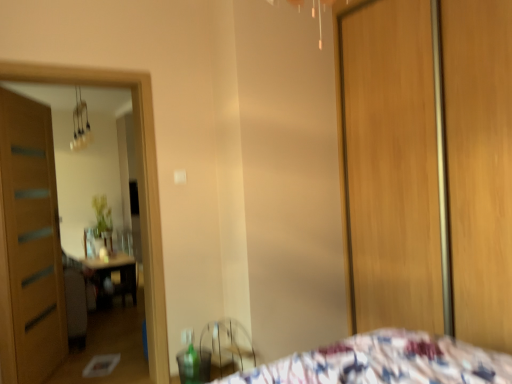
What do you see at coordinates (80, 123) in the screenshot? I see `metallic glass chandelier at upper left` at bounding box center [80, 123].

What do you see at coordinates (430, 165) in the screenshot?
I see `wooden screen door at right` at bounding box center [430, 165].

The width and height of the screenshot is (512, 384). Find the location of `wooden door at left`. wooden door at left is located at coordinates (31, 240).

Is wooden screen door at right at the left side of wooden door at left?

A: No.

From a real-world perspective, is wooden screen door at right under wooden door at left?

No, from a real-world perspective, wooden screen door at right is not under wooden door at left.

Is wooden screen door at right directly adjacent to wooden door at left?

No, wooden screen door at right is not in contact with wooden door at left.

From a real-world perspective, which object rests below the other?

wooden screen door at right is physically lower.

Image resolution: width=512 pixels, height=384 pixels. Find the location of `screen door located on the right of metallic glass chandelier at upper left`. screen door located on the right of metallic glass chandelier at upper left is located at coordinates (430, 165).

Based on the photo, in the image, is wooden screen door at right on the left side or the right side of metallic glass chandelier at upper left?

In the image, wooden screen door at right appears on the right side of metallic glass chandelier at upper left.

Does wooden screen door at right have a greater width compared to metallic glass chandelier at upper left?

Incorrect, the width of wooden screen door at right does not surpass that of metallic glass chandelier at upper left.

How many degrees apart are the facing directions of metallic glass chandelier at upper left and wooden screen door at right?

The angle between the facing direction of metallic glass chandelier at upper left and the facing direction of wooden screen door at right is 177 degrees.

Considering the positions of points (76, 140) and (453, 151), is point (76, 140) closer to camera compared to point (453, 151)?

That is False.

Is metallic glass chandelier at upper left not inside wooden screen door at right?

Yes, metallic glass chandelier at upper left is not within wooden screen door at right.

From the picture: From a real-world perspective, is metallic glass chandelier at upper left physically located above or below wooden screen door at right?

In terms of real-world spatial position, metallic glass chandelier at upper left is above wooden screen door at right.

How much distance is there between wooden door at left and metallic glass chandelier at upper left?

They are 2.33 meters apart.

Where is `door that is below the metallic glass chandelier at upper left (from the image's perspective)`? door that is below the metallic glass chandelier at upper left (from the image's perspective) is located at coordinates (31, 240).

Is metallic glass chandelier at upper left a part of wooden door at left?

No, wooden door at left does not contain metallic glass chandelier at upper left.

Considering the relative positions of wooden door at left and metallic glass chandelier at upper left in the image provided, is wooden door at left behind metallic glass chandelier at upper left?

No, the depth of wooden door at left is less than that of metallic glass chandelier at upper left.

Does wooden door at left come behind wooden screen door at right?

Yes.

Considering the relative positions of wooden door at left and wooden screen door at right in the image provided, is wooden door at left to the left of wooden screen door at right from the viewer's perspective?

Yes.

Is wooden door at left spatially inside wooden screen door at right, or outside of it?

wooden door at left is outside wooden screen door at right.

Considering the sizes of metallic glass chandelier at upper left and wooden door at left in the image, is metallic glass chandelier at upper left wider or thinner than wooden door at left?

In the image, metallic glass chandelier at upper left appears to be wider than wooden door at left.

Is metallic glass chandelier at upper left taller or shorter than wooden door at left?

Clearly, metallic glass chandelier at upper left is shorter compared to wooden door at left.

Is point (87, 140) positioned before point (8, 265)?

No.

Find the location of a particular element. The image size is (512, 384). door on the right side of metallic glass chandelier at upper left is located at coordinates (31, 240).

The width and height of the screenshot is (512, 384). Identify the location of door that appears below the wooden screen door at right (from the image's perspective). (31, 240).

Locate an element on the screen. The image size is (512, 384). light fixture that is behind the wooden screen door at right is located at coordinates (80, 123).

Which object lies nearer to the anchor point wooden door at left, wooden screen door at right or metallic glass chandelier at upper left?

metallic glass chandelier at upper left lies closer to wooden door at left than the other object.

From the image, which object appears to be nearer to wooden screen door at right, wooden door at left or metallic glass chandelier at upper left?

wooden door at left is closer to wooden screen door at right.

When comparing their distances from wooden door at left, does metallic glass chandelier at upper left or wooden screen door at right seem further?

The object further to wooden door at left is wooden screen door at right.

From the image, which object appears to be nearer to metallic glass chandelier at upper left, wooden screen door at right or wooden door at left?

wooden door at left is positioned closer to the anchor metallic glass chandelier at upper left.

Looking at this image, looking at the image, which one is located further to metallic glass chandelier at upper left, wooden door at left or wooden screen door at right?

Based on the image, wooden screen door at right appears to be further to metallic glass chandelier at upper left.

From the image, which object appears to be nearer to wooden screen door at right, metallic glass chandelier at upper left or wooden door at left?

Among the two, wooden door at left is located nearer to wooden screen door at right.

You are a GUI agent. You are given a task and a screenshot of the screen. Output one action in this format:
    pyautogui.click(x=<x>, y=<y>)
    Task: Click on the door between metallic glass chandelier at upper left and wooden screen door at right from left to right
    
    Given the screenshot: What is the action you would take?
    pyautogui.click(x=31, y=240)